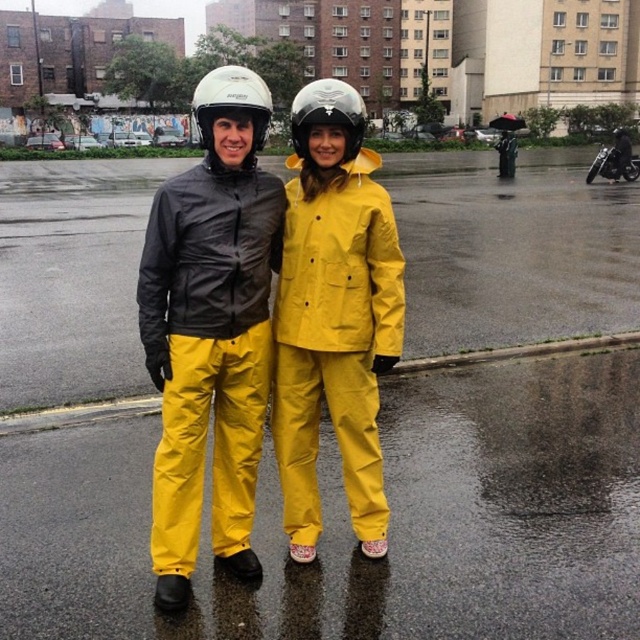
Does yellow waterproof raincoat at center have a greater height compared to white matte helmet at upper center?

No.

Which is above, yellow waterproof raincoat at center or white matte helmet at upper center?

white matte helmet at upper center

Between point (310, 192) and point (202, 113), which one is positioned in front?

Point (202, 113)

Where is `yellow waterproof raincoat at center`? yellow waterproof raincoat at center is located at coordinates (333, 316).

Who is positioned more to the right, yellow waterproof raincoat at center or white matte helmet at center?

yellow waterproof raincoat at center

Measure the distance between point (401, 337) and camera.

Point (401, 337) is 9.19 feet from camera.

Find the location of a particular element. The height and width of the screenshot is (640, 640). yellow waterproof raincoat at center is located at coordinates (333, 316).

Who is positioned more to the left, yellow matte rain suit at center or shiny black motorcycle at upper right?

From the viewer's perspective, yellow matte rain suit at center appears more on the left side.

Does yellow matte rain suit at center appear on the left side of shiny black motorcycle at upper right?

Indeed, yellow matte rain suit at center is positioned on the left side of shiny black motorcycle at upper right.

You are a GUI agent. You are given a task and a screenshot of the screen. Output one action in this format:
    pyautogui.click(x=<x>, y=<y>)
    Task: Click on the yellow matte rain suit at center
    The height and width of the screenshot is (640, 640).
    Given the screenshot: What is the action you would take?
    pyautogui.click(x=346, y=285)